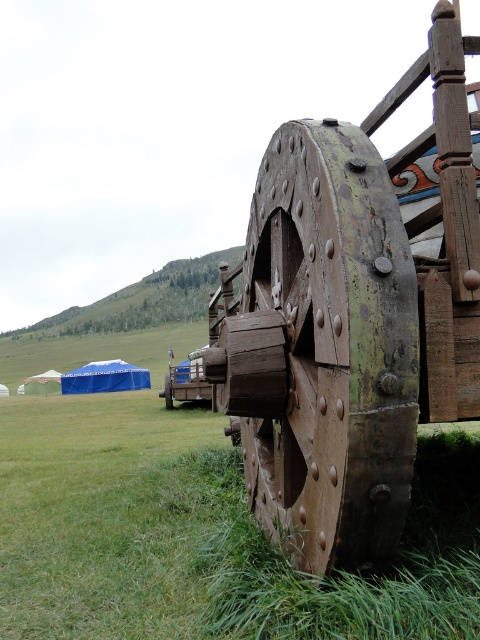
Is blue fabric tent at lower left above wooden wheel at lower right?

No.

The image size is (480, 640). I want to click on blue fabric tent at lower left, so click(105, 378).

Is point (63, 388) closer to viewer compared to point (48, 387)?

Yes, it is in front of point (48, 387).

Can you confirm if blue fabric tent at lower left is wider than white fabric tent at lower left?

No, blue fabric tent at lower left is not wider than white fabric tent at lower left.

Which is in front, point (92, 385) or point (40, 390)?

Point (92, 385)

Where is `blue fabric tent at lower left`? The width and height of the screenshot is (480, 640). blue fabric tent at lower left is located at coordinates (105, 378).

From the picture: Does white fabric tent at lower left appear under wooden wheel at lower right?

Indeed, white fabric tent at lower left is positioned under wooden wheel at lower right.

This screenshot has height=640, width=480. Describe the element at coordinates (41, 381) in the screenshot. I see `white fabric tent at lower left` at that location.

Who is more forward, (44, 390) or (167, 403)?

Point (167, 403) is in front.

Where is `white fabric tent at lower left`? This screenshot has height=640, width=480. white fabric tent at lower left is located at coordinates (41, 381).